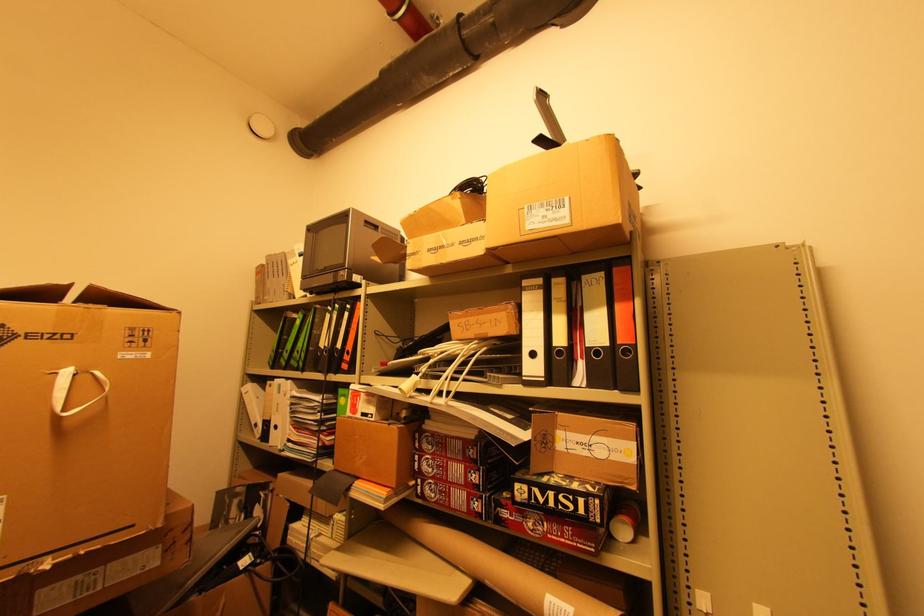
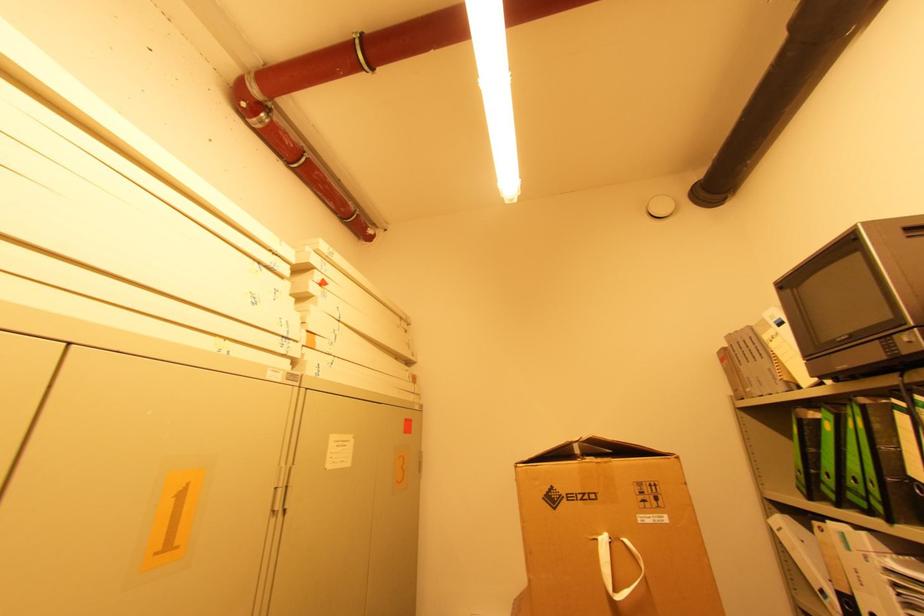
The point at (306, 371) is marked in the first image. Where is the corresponding point in the second image?

(894, 522)